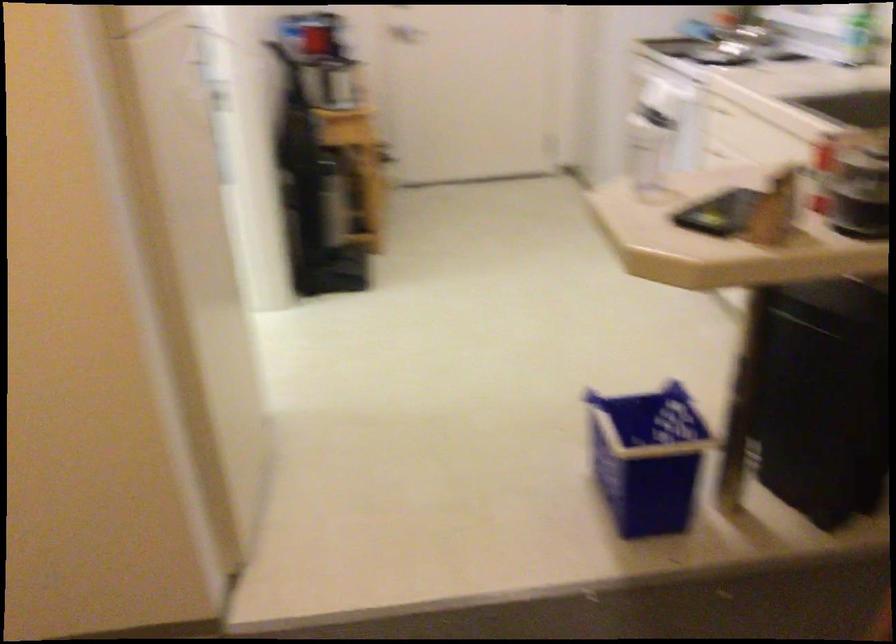
The first image is from the beginning of the video and the second image is from the end. How did the camera likely rotate when shooting the video?

The camera rotated toward right-down.